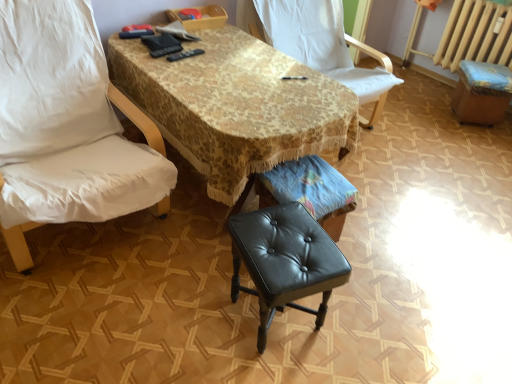
Question: Considering the relative sizes of black leather bar stool at lower right and black leather stool at center in the image provided, is black leather bar stool at lower right bigger than black leather stool at center?

Choices:
 (A) yes
 (B) no

Answer: (B)

Question: Is black leather bar stool at lower right wider than black leather stool at center?

Choices:
 (A) no
 (B) yes

Answer: (A)

Question: Does black leather bar stool at lower right contain black leather stool at center?

Choices:
 (A) yes
 (B) no

Answer: (B)

Question: Is black leather bar stool at lower right looking in the opposite direction of black leather stool at center?

Choices:
 (A) yes
 (B) no

Answer: (B)

Question: Is the position of black leather bar stool at lower right more distant than that of black leather stool at center?

Choices:
 (A) no
 (B) yes

Answer: (B)

Question: In terms of width, does white fabric chair at center, the second chair viewed from the left, look wider or thinner when compared to black leather bar stool at lower right?

Choices:
 (A) thin
 (B) wide

Answer: (B)

Question: Is white fabric chair at center, the first chair positioned from the right, taller or shorter than black leather bar stool at lower right?

Choices:
 (A) short
 (B) tall

Answer: (B)

Question: Relative to black leather bar stool at lower right, is white fabric chair at center, the second chair viewed from the left, in front or behind?

Choices:
 (A) behind
 (B) front

Answer: (B)

Question: From the image's perspective, is white fabric chair at center, the second chair viewed from the left, above or below black leather bar stool at lower right?

Choices:
 (A) below
 (B) above

Answer: (B)

Question: From the image's perspective, is white fabric chair at left, which appears as the first chair when viewed from the left, positioned above or below black leather music stool at center?

Choices:
 (A) below
 (B) above

Answer: (B)

Question: Relative to black leather music stool at center, is white fabric chair at left, which is the second chair in right-to-left order, in front or behind?

Choices:
 (A) behind
 (B) front

Answer: (B)

Question: From a real-world perspective, is white fabric chair at left, which is the second chair in right-to-left order, physically located above or below black leather music stool at center?

Choices:
 (A) below
 (B) above

Answer: (B)

Question: Which is correct: white fabric chair at left, which is the second chair in right-to-left order, is inside black leather music stool at center, or outside of it?

Choices:
 (A) outside
 (B) inside

Answer: (A)

Question: From their relative heights in the image, would you say black leather stool at center is taller or shorter than gold lace tablecloth at center?

Choices:
 (A) tall
 (B) short

Answer: (B)

Question: From the image's perspective, is black leather stool at center above or below gold lace tablecloth at center?

Choices:
 (A) below
 (B) above

Answer: (A)